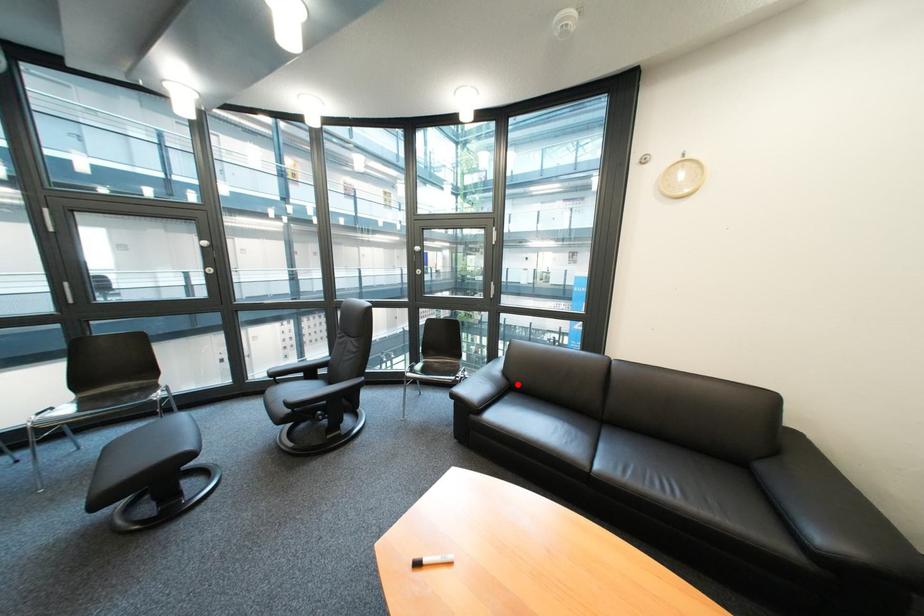
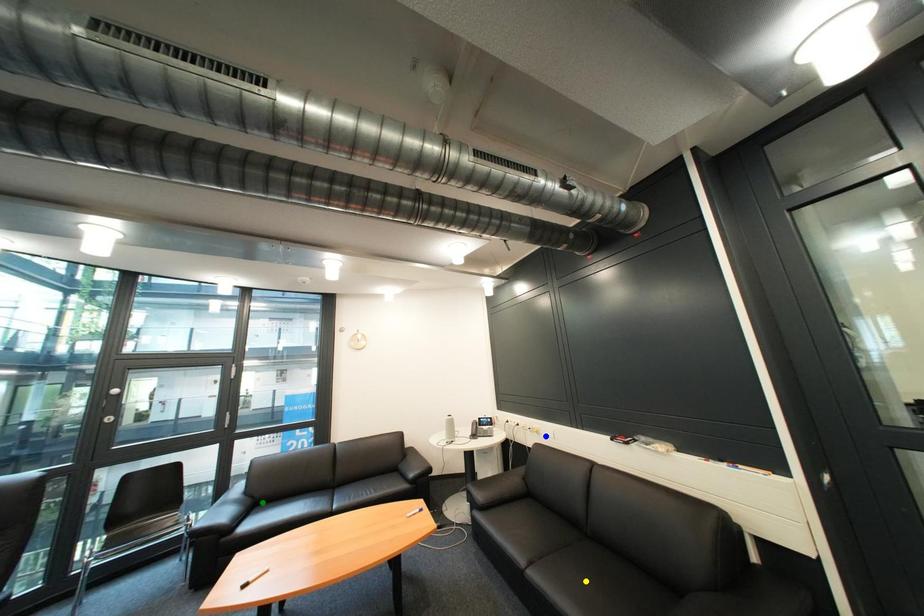
Question: I am providing you with two images of the same scene from different viewpoints. A red point is marked on the first image. You are given multiple points on the second image. Which point in image 2 represents the same 3d spot as the red point in image 1?

Choices:
 (A) green point
 (B) blue point
 (C) yellow point

Answer: (A)